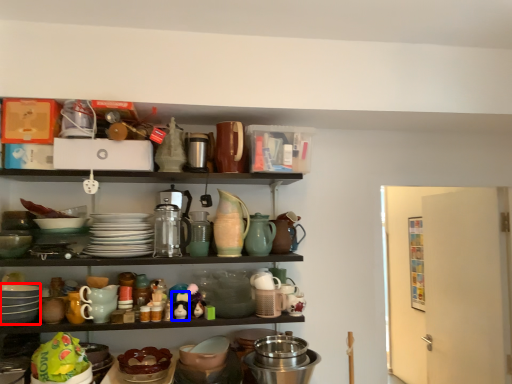
Question: Among these objects, which one is farthest to the camera, tableware (highlighted by a red box) or toy (highlighted by a blue box)?

Choices:
 (A) tableware
 (B) toy

Answer: (B)